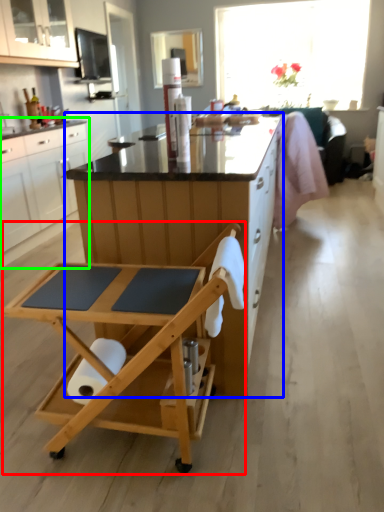
Question: Estimate the real-world distances between objects in this image. Which object is farther from table (highlighted by a red box), desk (highlighted by a blue box) or cabinetry (highlighted by a green box)?

Choices:
 (A) desk
 (B) cabinetry

Answer: (B)